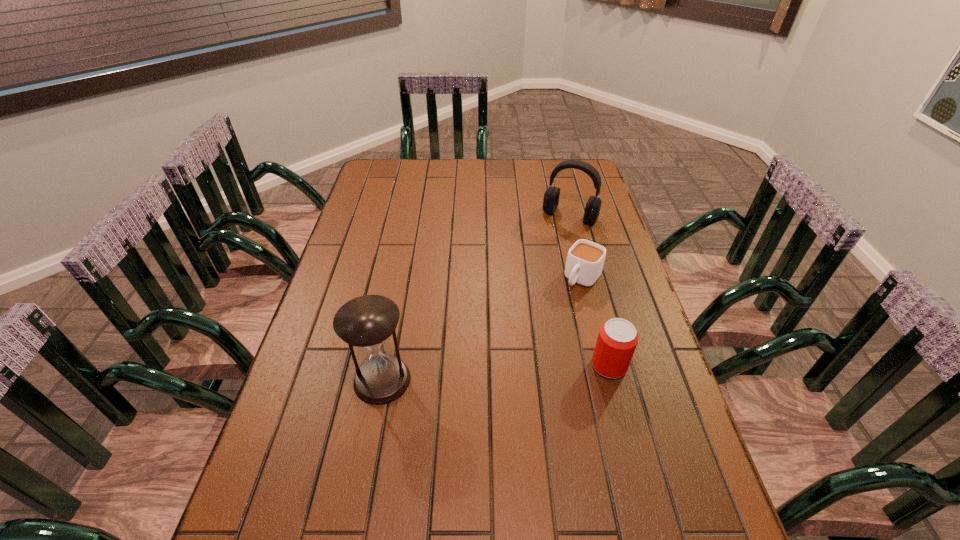
The width and height of the screenshot is (960, 540). Find the location of `vacant space on the desktop that is between the leftmost object and the beer can and is positioned on the side with the handle of the second farthest object`. vacant space on the desktop that is between the leftmost object and the beer can and is positioned on the side with the handle of the second farthest object is located at coordinates (511, 372).

I want to click on vacant space on the desktop that is between the leftmost object and the beer can and is positioned on the headband of the farthest object, so 476,374.